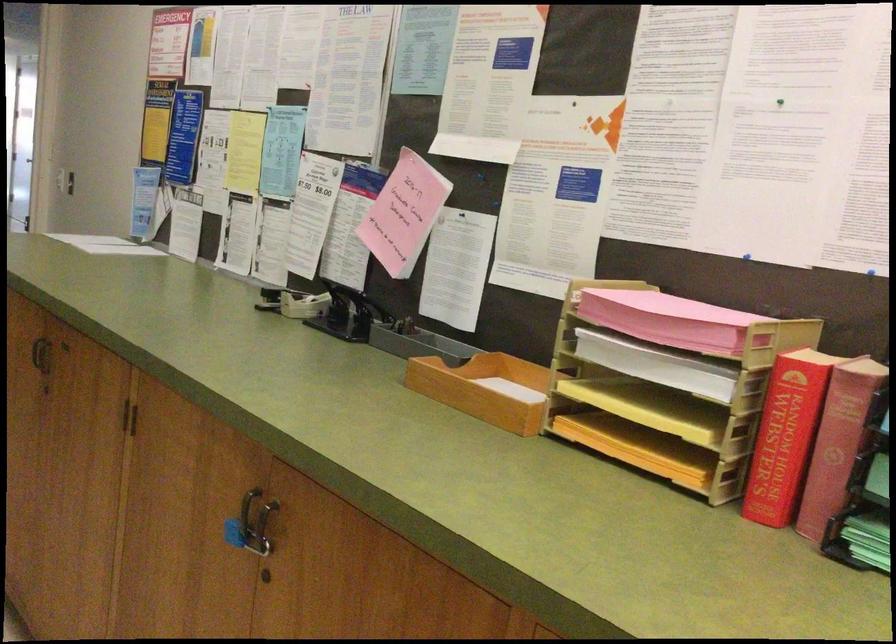
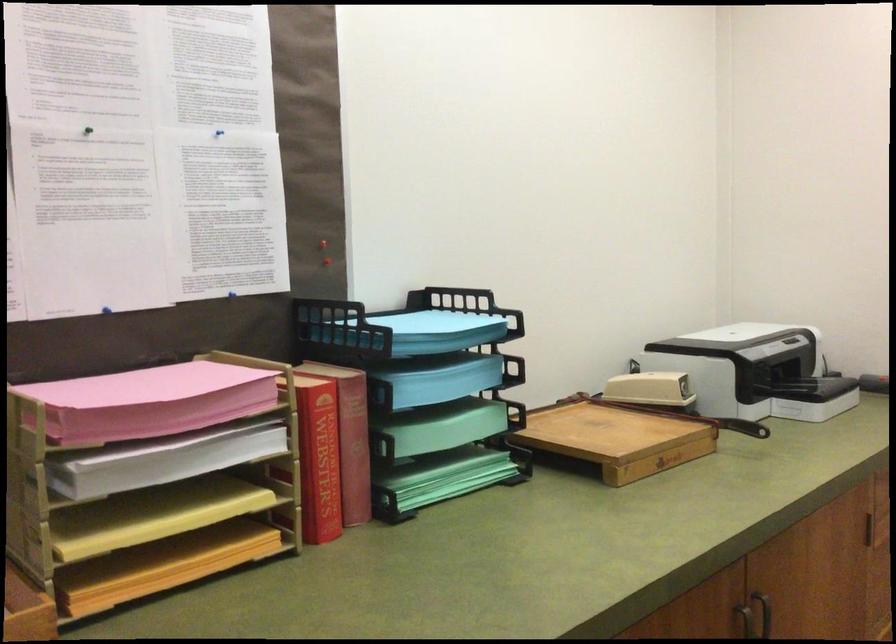
In the second image, find the point that corresponds to the point at 782,428 in the first image.

(319, 456)